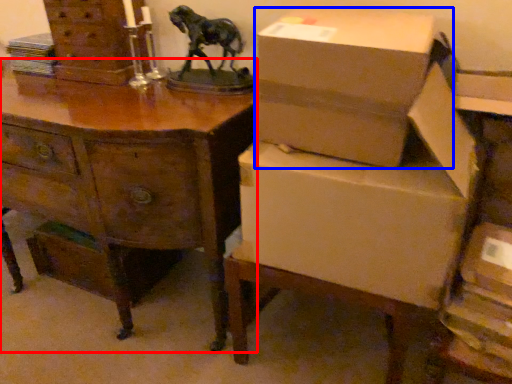
Question: Which object is closer to the camera taking this photo, desk (highlighted by a red box) or box (highlighted by a blue box)?

Choices:
 (A) desk
 (B) box

Answer: (B)